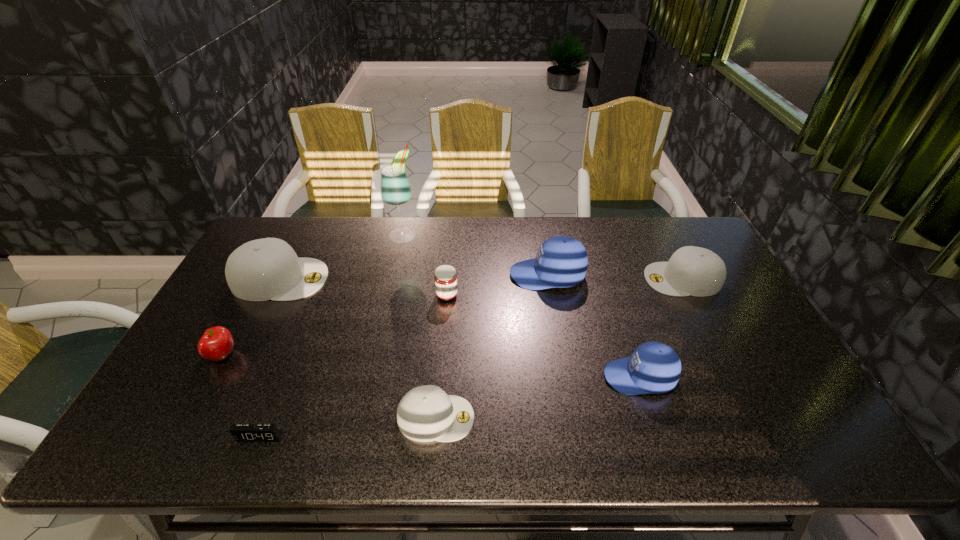
Image resolution: width=960 pixels, height=540 pixels. I want to click on alcohol, so click(x=395, y=189).

This screenshot has width=960, height=540. I want to click on the fourth object from left to right, so click(395, 189).

Locate an element on the screen. Image resolution: width=960 pixels, height=540 pixels. the farther blue cap is located at coordinates (561, 261).

Identify the location of the leftmost gray cap. tap(264, 269).

I want to click on the leftmost cap, so click(264, 269).

Locate an element on the screen. This screenshot has height=540, width=960. the rightmost gray cap is located at coordinates (696, 271).

You are a GUI agent. You are given a task and a screenshot of the screen. Output one action in this format:
    pyautogui.click(x=<x>, y=<y>)
    Task: Click on the second smallest gray cap
    This screenshot has height=540, width=960.
    Given the screenshot: What is the action you would take?
    pyautogui.click(x=696, y=271)

Locate an element on the screen. This screenshot has width=960, height=540. the smaller blue cap is located at coordinates tap(653, 368).

Locate an element on the screen. red jam is located at coordinates (445, 277).

At what (x,y) coordinates should I click in order to perform the action: click on apple. Please return your answer as a coordinate pair (x, y). The width and height of the screenshot is (960, 540). Looking at the image, I should click on (216, 344).